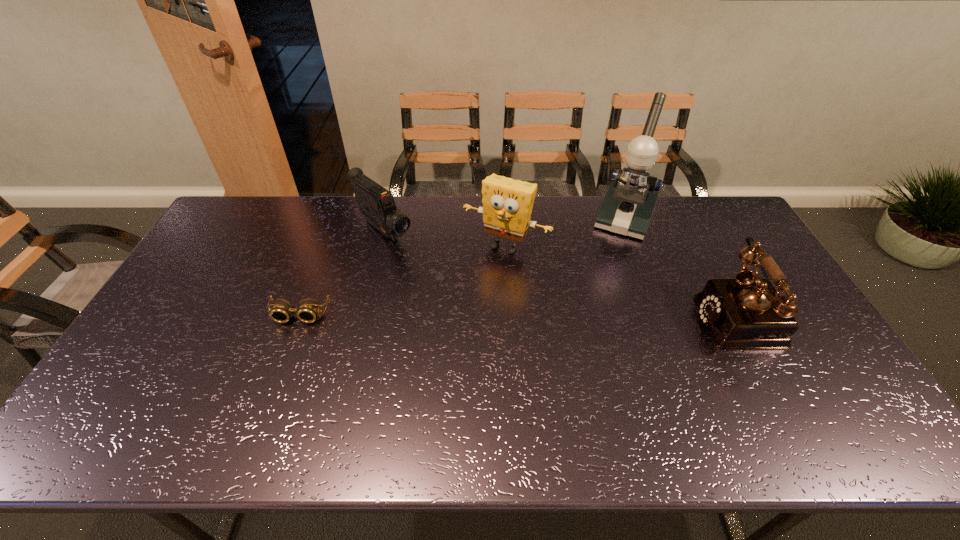
At what (x,y) coordinates should I click in order to perform the action: click on vacant space on the desktop that is between the goggles and the telephone and is positioned at the eyepiece of the microscope. Please return your answer as a coordinate pair (x, y). Looking at the image, I should click on (587, 315).

The height and width of the screenshot is (540, 960). In order to click on vacant spot on the desktop that is between the shortest object and the telephone and is positioned on the face of the sponge in this screenshot , I will do `click(463, 315)`.

I want to click on free space on the desktop that is between the shortest object and the telephone and is positioned on the front-facing side of the camcorder, so click(x=479, y=315).